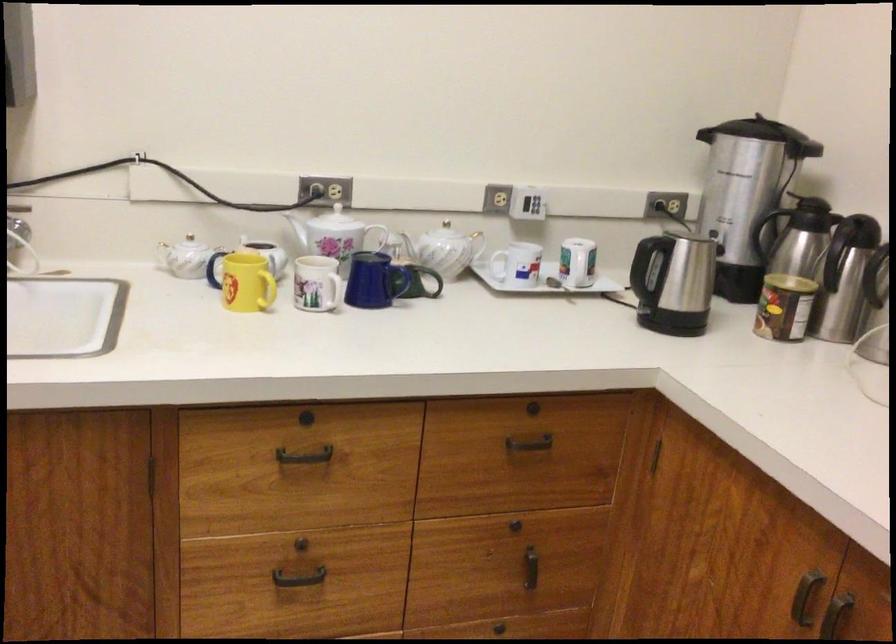
Find where to push the kettle switch. Please return your answer as a coordinate pair (x, y).

(794, 225)